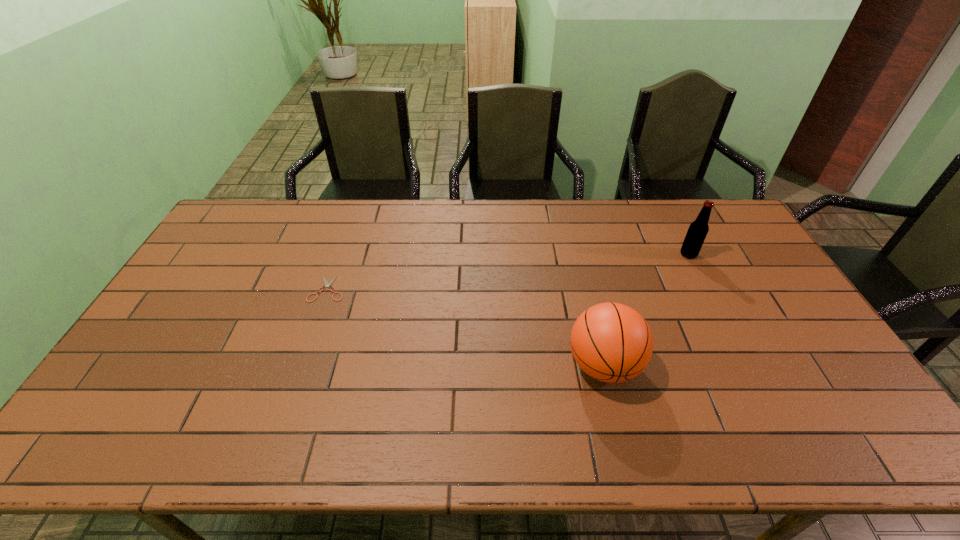
This screenshot has width=960, height=540. What are the coordinates of `free spot between the second object from left to right and the shortest object` in the screenshot? It's located at (466, 327).

The width and height of the screenshot is (960, 540). I want to click on free spot between the beer bottle and the second object from right to left, so click(x=646, y=310).

Where is `free spot between the second farthest object and the farthest object`? Image resolution: width=960 pixels, height=540 pixels. free spot between the second farthest object and the farthest object is located at coordinates pyautogui.click(x=508, y=272).

What are the coordinates of `empty location between the rightmost object and the second farthest object` in the screenshot? It's located at (508, 272).

Locate an element on the screen. The height and width of the screenshot is (540, 960). object that stands as the second closest to the second farthest object is located at coordinates (698, 229).

Identify which object is the nearest to the leftmost object. Please provide its 2D coordinates. Your answer should be formatted as a tuple, i.e. [(x, y)], where the tuple contains the x and y coordinates of a point satisfying the conditions above.

[(611, 342)]

At what (x,y) coordinates should I click in order to perform the action: click on vacant position in the image that satisfies the following two spatial constraints: 1. on the back side of the rightmost object; 2. on the left side of the shears. Please return your answer as a coordinate pair (x, y). The image size is (960, 540). Looking at the image, I should click on (340, 254).